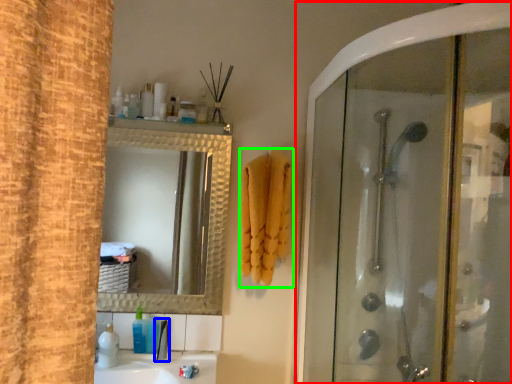
Question: Which object is positioned farthest from screen door (highlighted by a red box)? Select from faucet (highlighted by a blue box) and bath towel (highlighted by a green box).

Choices:
 (A) faucet
 (B) bath towel

Answer: (A)